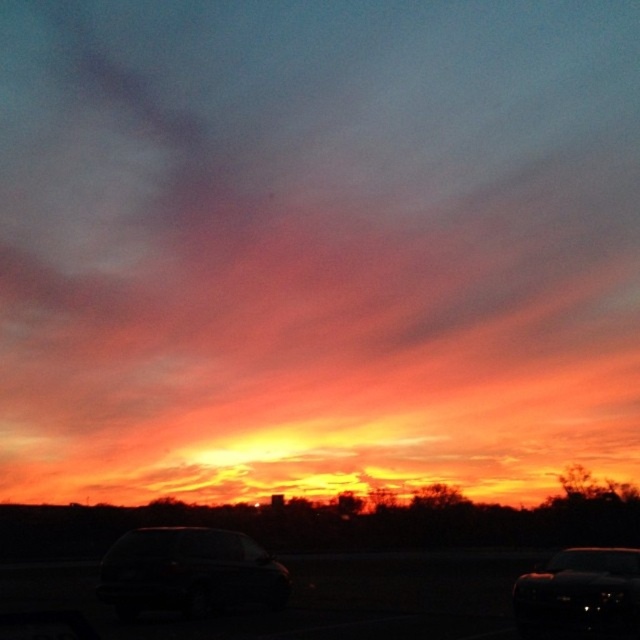
You are a photographer trying to capture the sunset. You notice the shiny black car at center and the transparent glass car window at lower right in your frame. Which object will appear larger in your photo?

The transparent glass car window at lower right appears larger in the photo because the shiny black car at center is smaller in size compared to it.

You are standing at the point with coordinates (579, 595) in the sunset scene. What object is located exactly at your current position?

The glossy black car at lower right is located at point (579, 595).